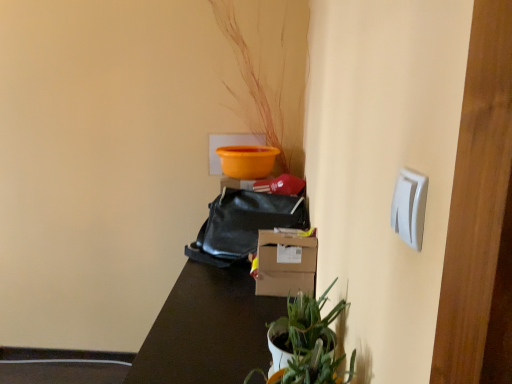
Where is `free space in front of black leather bag at center`? This screenshot has height=384, width=512. free space in front of black leather bag at center is located at coordinates (225, 291).